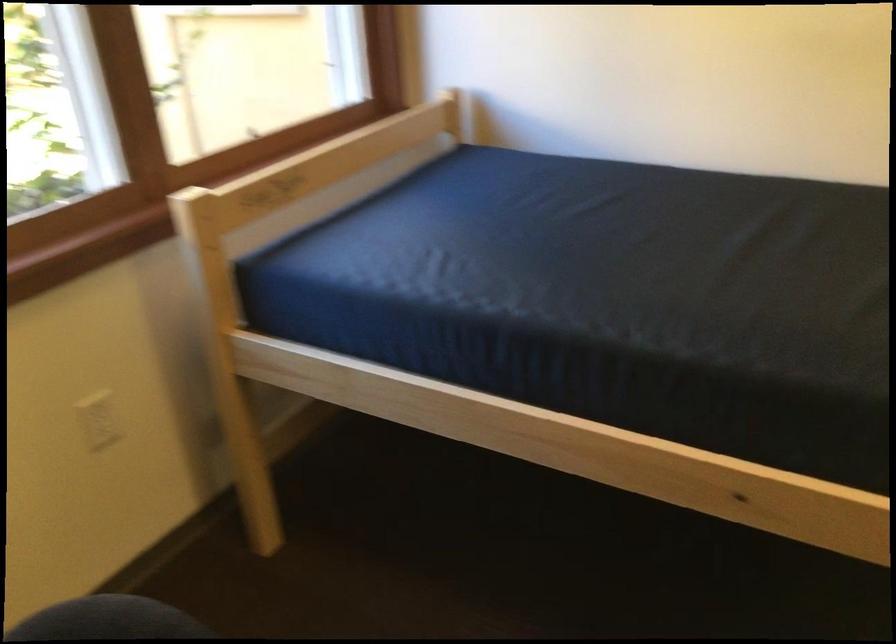
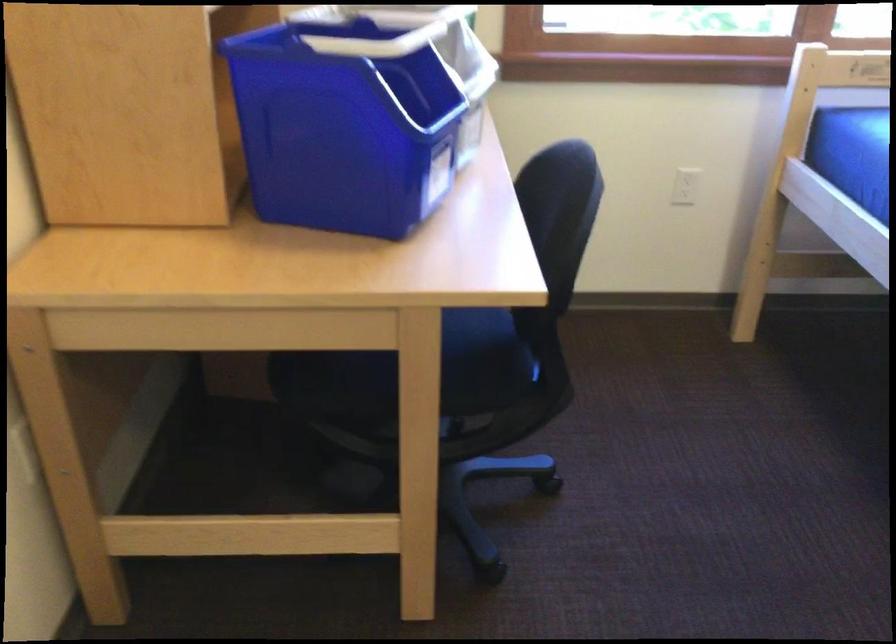
In the second image, find the point that corresponds to point 108,428 in the first image.

(683, 187)